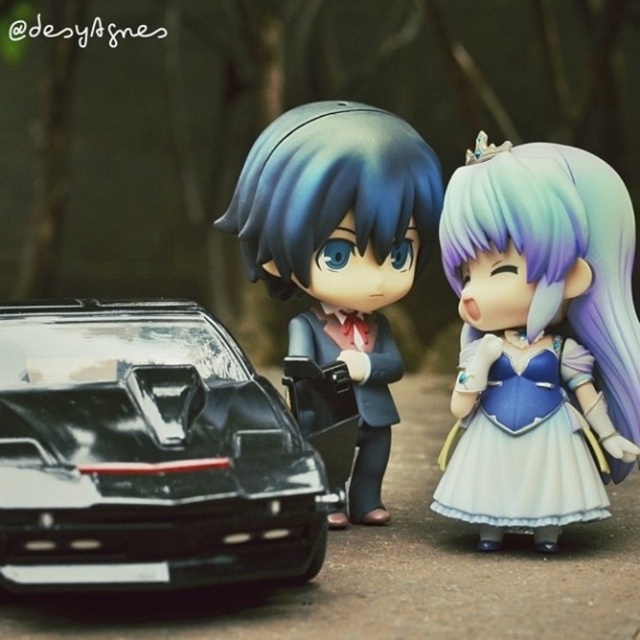
Which is more to the left, glossy black car at lower left or satin blue dress at right?

glossy black car at lower left

Does glossy black car at lower left appear under satin blue dress at right?

Yes.

Between point (10, 339) and point (464, 300), which one is positioned behind?

Positioned behind is point (464, 300).

Locate an element on the screen. glossy black car at lower left is located at coordinates (147, 454).

Measure the distance from glossy black car at lower left to satin blue dress at center.

glossy black car at lower left is 27.86 centimeters away from satin blue dress at center.

Can you confirm if glossy black car at lower left is bigger than satin blue dress at center?

Actually, glossy black car at lower left might be smaller than satin blue dress at center.

Identify the location of glossy black car at lower left. (147, 454).

Is satin blue dress at right below satin blue dress at center?

Correct, satin blue dress at right is located below satin blue dress at center.

Is satin blue dress at right taller than satin blue dress at center?

In fact, satin blue dress at right may be shorter than satin blue dress at center.

Image resolution: width=640 pixels, height=640 pixels. Describe the element at coordinates (538, 339) in the screenshot. I see `satin blue dress at right` at that location.

Find the location of a particular element. Image resolution: width=640 pixels, height=640 pixels. satin blue dress at right is located at coordinates (538, 339).